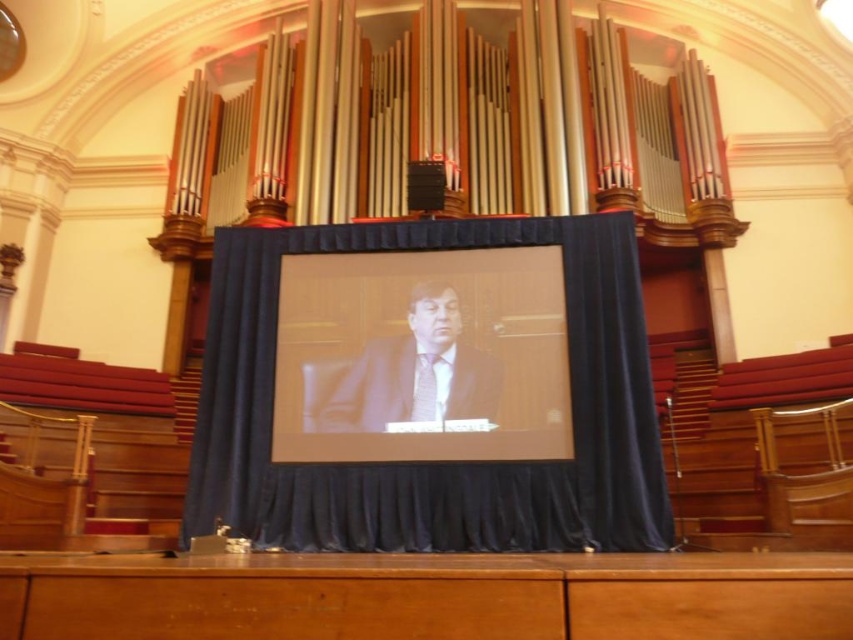
You are an event planner setting up a stage for a presentation. You need to position a microphone stand between the matte black screen at center and the matte suit at center. Based on their positions, which side of the microphone stand should face the audience?

The matte black screen at center is to the right of the matte suit at center, so the microphone stand should be positioned with its front facing the audience between them. Since the screen is to the right of the suit, the microphone stand should face towards the audience, positioned between the two objects.

You are standing in the front row of the venue and want to see the man on the screen clearly. Is the velvet blue curtain at center blocking your view?

The velvet blue curtain at center is located at point (432, 470), which is directly in the center of the venue. Since you are in the front row, the curtain would likely block your view of the man on the screen.